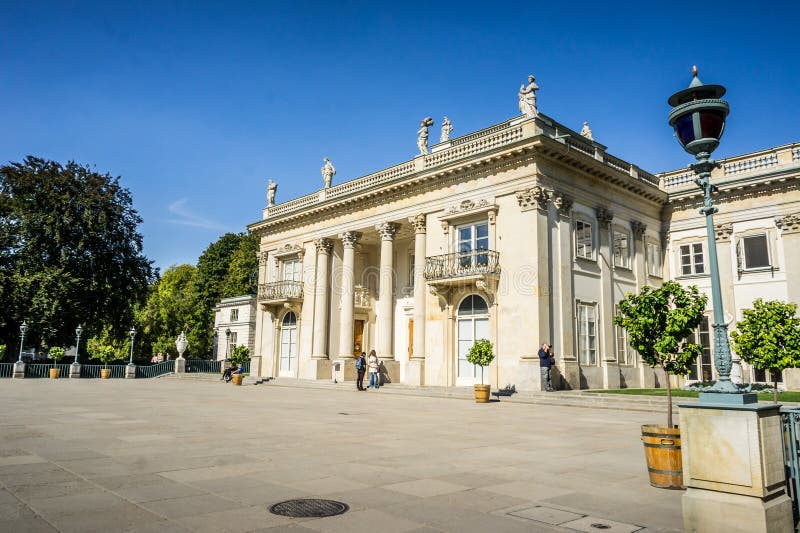
This screenshot has height=533, width=800. In order to click on light in this screenshot , I will do `click(697, 111)`.